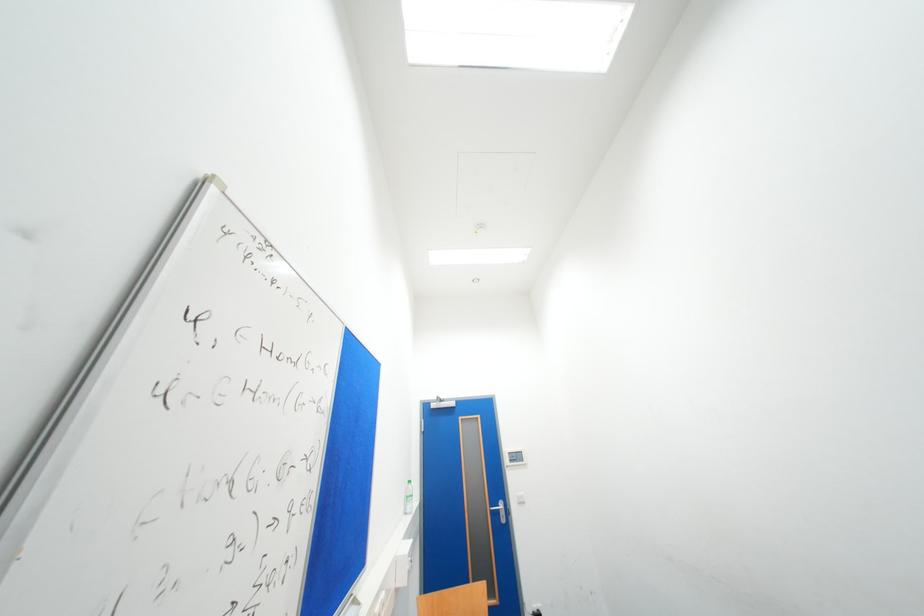
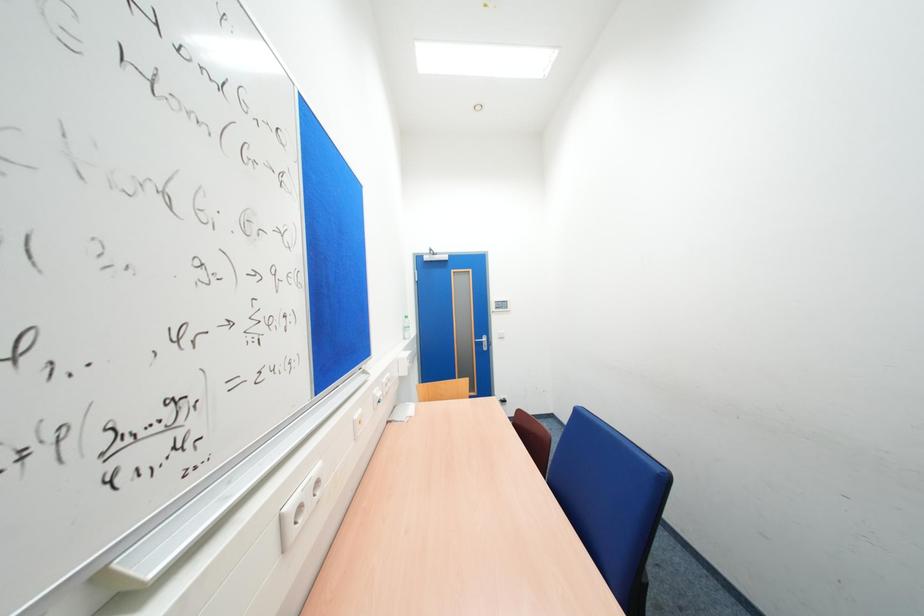
Question: The first image is from the beginning of the video and the second image is from the end. How did the camera likely rotate when shooting the video?

Choices:
 (A) Left
 (B) Right
 (C) Up
 (D) Down

Answer: (D)